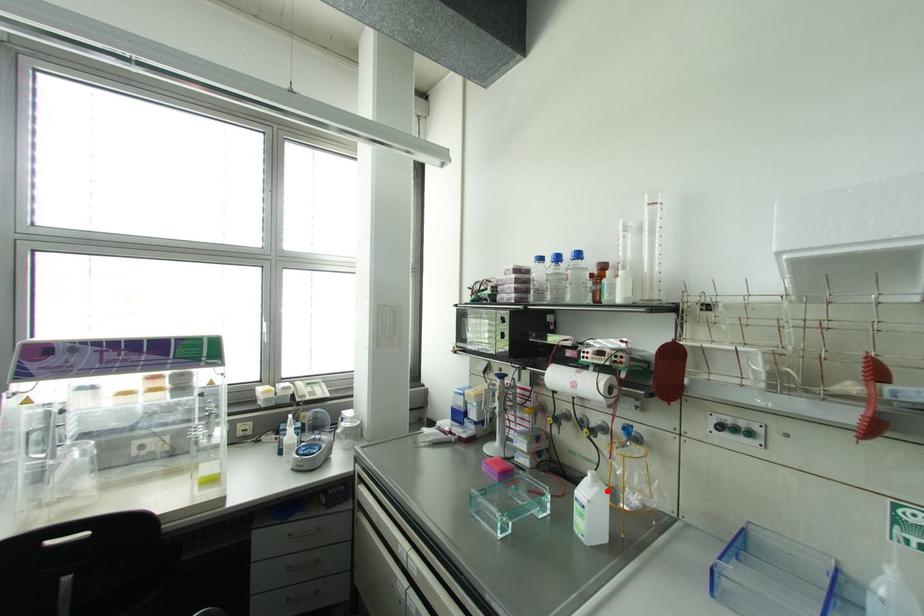
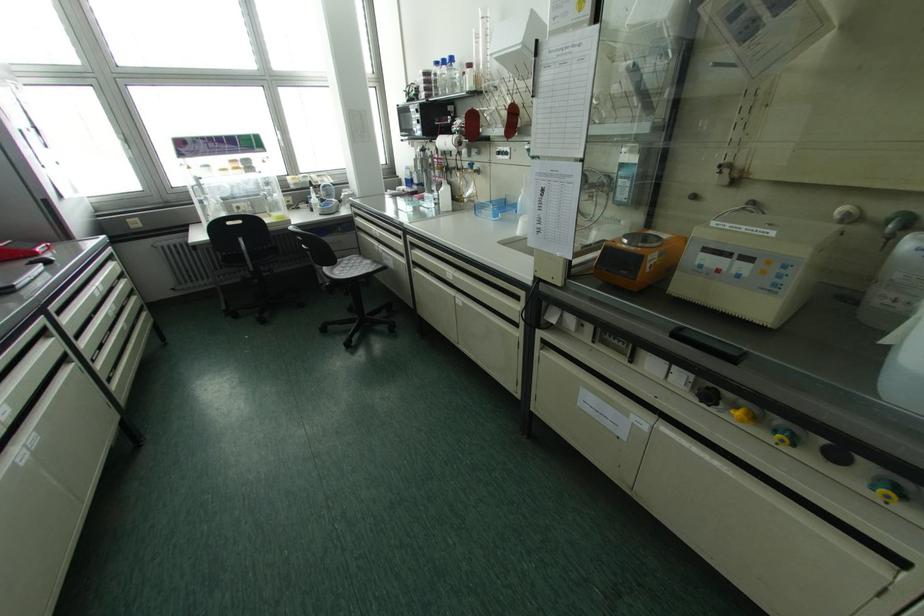
The point at the highlighted location is marked in the first image. Where is the corresponding point in the second image?

(448, 187)